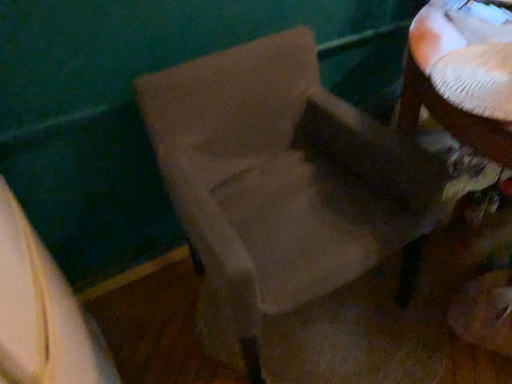
Locate an element on the screen. vacant space underneath white textured table at upper right (from a real-world perspective) is located at coordinates (482, 71).